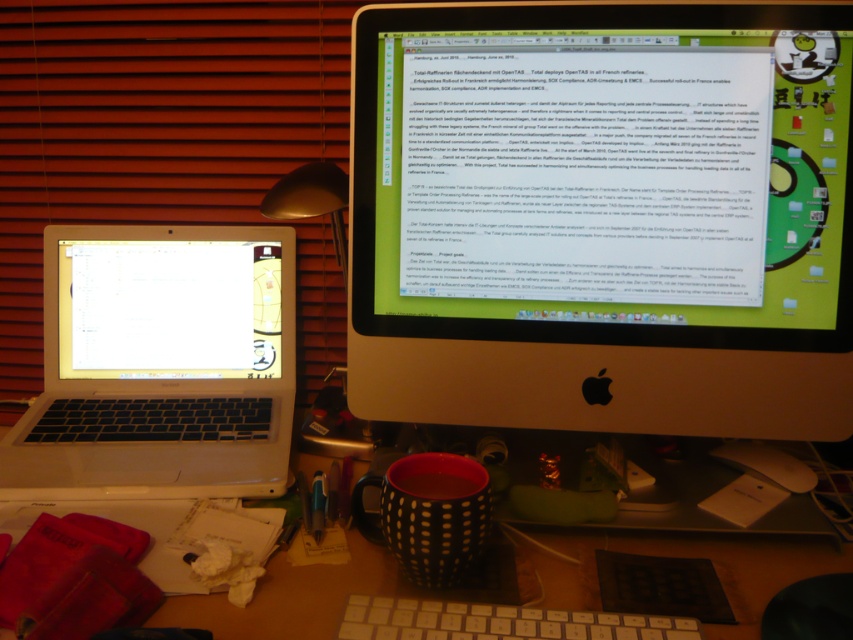
Who is more distant from viewer, (270,314) or (376,604)?

Positioned behind is point (270,314).

Does point (135, 275) lie behind point (447, 621)?

Yes.

Is point (219, 332) closer to camera compared to point (553, 625)?

That is False.

Locate an element on the screen. white glossy laptop at left is located at coordinates (169, 308).

Does point (96, 346) come in front of point (164, 275)?

No, (96, 346) is further to viewer.

Is white matte laptop at left bigger than white glossy laptop at left?

Yes.

Does point (242, 244) come farther from viewer compared to point (163, 241)?

Yes, point (242, 244) is farther from viewer.

Where is `white matte laptop at left`? This screenshot has height=640, width=853. white matte laptop at left is located at coordinates (160, 364).

Between white matte laptop at left and white plastic keyboard at center, which one appears on the right side from the viewer's perspective?

Positioned to the right is white plastic keyboard at center.

Is point (19, 432) positioned behind point (485, 634)?

Yes, it is.

The width and height of the screenshot is (853, 640). Identify the location of white matte laptop at left. 160,364.